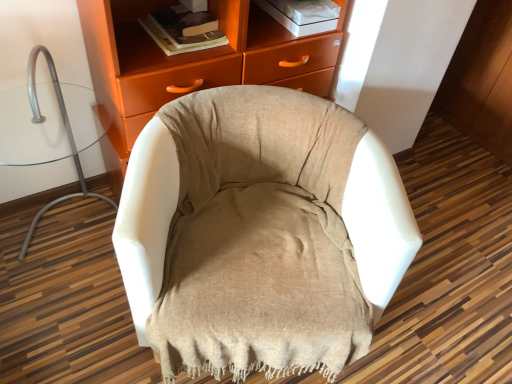
Question: Visually, is matte orange cabinet at upper center positioned to the left or to the right of white fabric chair at left?

Choices:
 (A) right
 (B) left

Answer: (A)

Question: Choose the correct answer: Is matte orange cabinet at upper center inside white fabric chair at left or outside it?

Choices:
 (A) outside
 (B) inside

Answer: (A)

Question: Which is nearer to the beige fabric chair at center?

Choices:
 (A) hardcover book at upper center
 (B) matte orange cabinet at upper center
 (C) white fabric chair at left

Answer: (B)

Question: Considering the real-world distances, which object is closest to the white fabric chair at left?

Choices:
 (A) matte orange cabinet at upper center
 (B) hardcover book at upper center
 (C) beige fabric chair at center

Answer: (A)